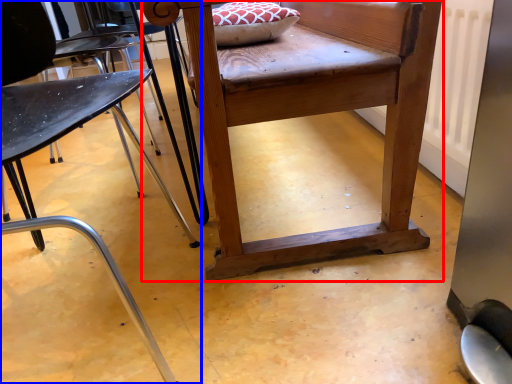
Question: Among these objects, which one is farthest to the camera, table (highlighted by a red box) or chair (highlighted by a blue box)?

Choices:
 (A) table
 (B) chair

Answer: (A)